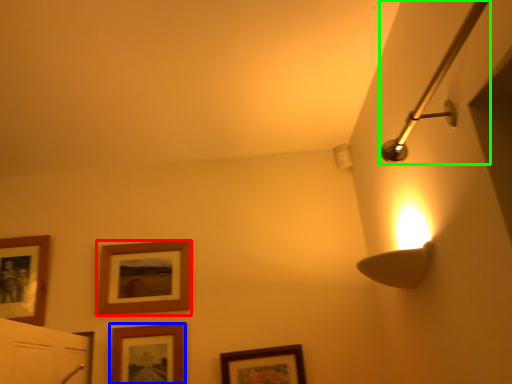
Question: Considering the real-world distances, which object is closest to picture frame (highlighted by a red box)? picture frame (highlighted by a blue box) or shower (highlighted by a green box).

Choices:
 (A) picture frame
 (B) shower

Answer: (A)